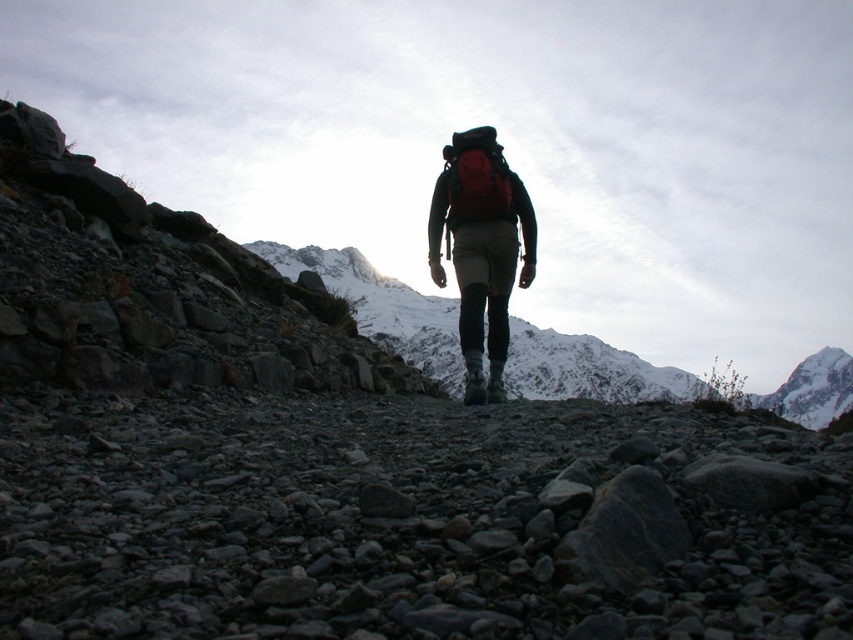
Based on the photo, you are a photographer trying to capture the red fabric backpack at center and the snowy white peak at upper right in the same frame. Which object will appear narrower in the photo?

The red fabric backpack at center will appear narrower in the photo because it is thinner than the snowy white peak at upper right.

You are a photographer trying to capture the snowy white peak at upper right in your shot. However, the red fabric backpack at center is blocking your view. Can you determine if you can see the peak by moving the camera slightly upwards or downwards?

The red fabric backpack at center is located above snowy white peak at upper right, so moving the camera downwards would allow you to see the peak without the backpack blocking it.